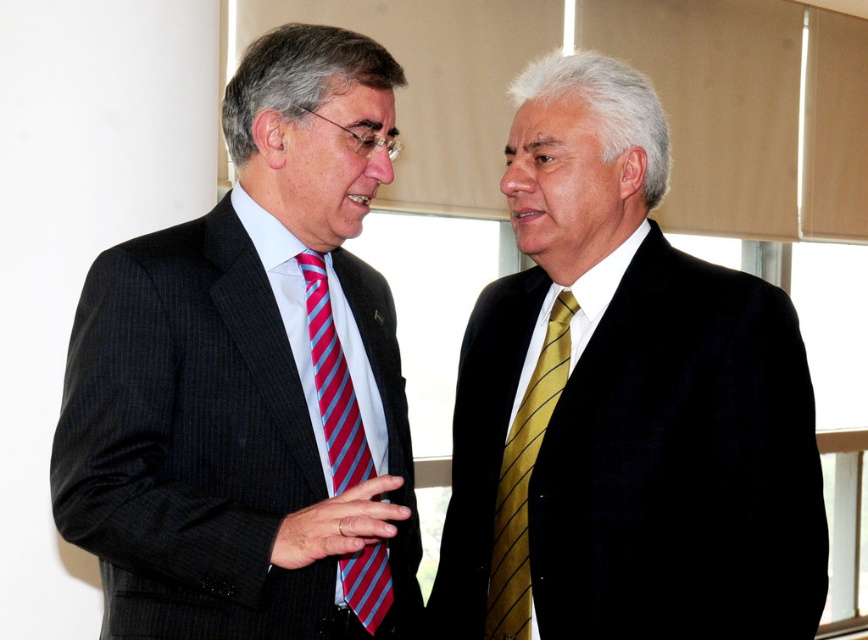
You are standing in the room and want to walk from point A to point B. The coordinates for point A are point A at (659, 189) and point B are point B at (544, 362). Given that point A is behind point B, will you pass in front of the man on the right during your journey?

Since point A at (659, 189) is behind point B at (544, 362), walking from point A to point B would require moving forward towards point B. Therefore, you will pass in front of the man on the right during your journey.

You are a photographer trying to capture a closeup of the gold striped tie at right without including the matte black suit at right in the frame. Given that your camera has a focal length of 5 inches, can you determine if it is possible to achieve this?

The matte black suit at right is 4.81 inches from gold striped tie at right. Since the distance between them is less than the camera focal length of 5 inches, it may be challenging to capture the gold striped tie at right without including the matte black suit at right in the frame.